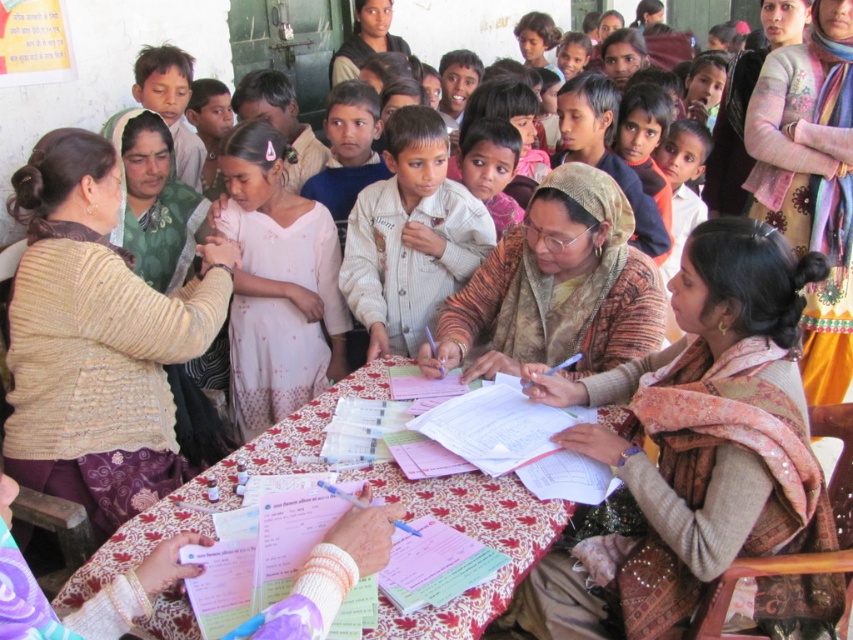
Question: Estimate the real-world distances between objects in this image. Which object is closer to the matte black headscarf at upper center?

Choices:
 (A) patterned fabric table at center
 (B) brown textured shawl at center
 (C) light beige jacket at center

Answer: (C)

Question: Is matte brown shawl at center wider than printed fabric scarf at upper right?

Choices:
 (A) no
 (B) yes

Answer: (B)

Question: Is matte brown shawl at center positioned behind patterned fabric table at center?

Choices:
 (A) no
 (B) yes

Answer: (B)

Question: Estimate the real-world distances between objects in this image. Which object is farther from the pink fabric dress at center?

Choices:
 (A) matte black headscarf at upper center
 (B) light beige jacket at center

Answer: (A)

Question: Among these points, which one is nearest to the camera?

Choices:
 (A) (570, 276)
 (B) (495, 612)
 (C) (785, 154)

Answer: (B)

Question: Is brown textured shawl at center smaller than patterned fabric table at center?

Choices:
 (A) yes
 (B) no

Answer: (A)